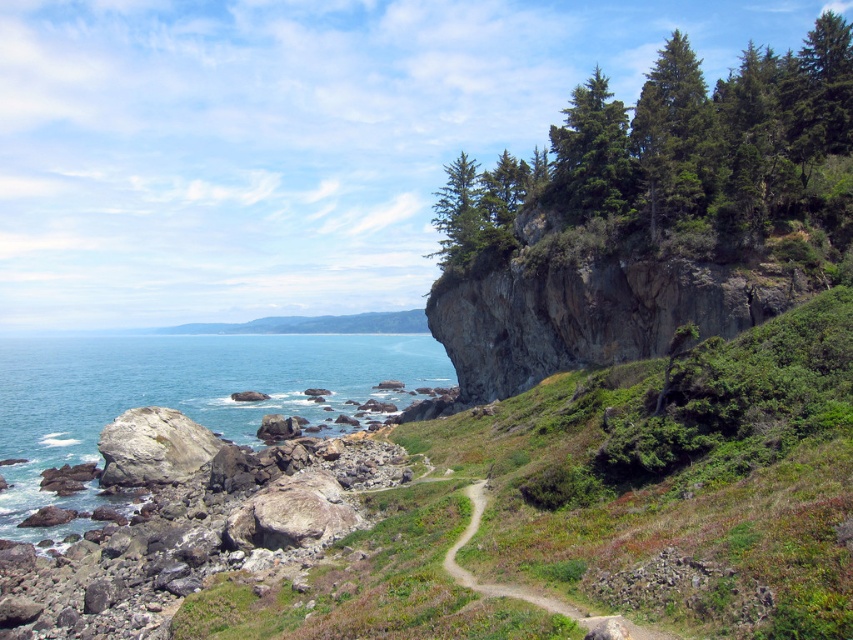
How much distance is there between green textured pine at upper right and white rock at lower left?

green textured pine at upper right and white rock at lower left are 116.96 feet apart.

Which of these two, green textured pine at upper right or white rock at lower left, stands taller?

green textured pine at upper right is taller.

This screenshot has width=853, height=640. What do you see at coordinates (672, 154) in the screenshot?
I see `green textured pine at upper right` at bounding box center [672, 154].

Find the location of a particular element. The width and height of the screenshot is (853, 640). green textured pine at upper right is located at coordinates (672, 154).

Is green textured pine at upper right smaller than smooth gray rock at lower left?

Incorrect, green textured pine at upper right is not smaller in size than smooth gray rock at lower left.

Consider the image. Who is more distant from viewer, (x=787, y=52) or (x=90, y=532)?

The point (x=787, y=52) is more distant.

I want to click on green textured pine at upper right, so click(x=672, y=154).

Between point (48, 577) and point (201, 461), which one is positioned behind?

The point (201, 461) is behind.

Which is in front, point (338, 508) or point (204, 460)?

Positioned in front is point (338, 508).

Identify the location of smooth gray rock at lower left. This screenshot has height=640, width=853. (189, 524).